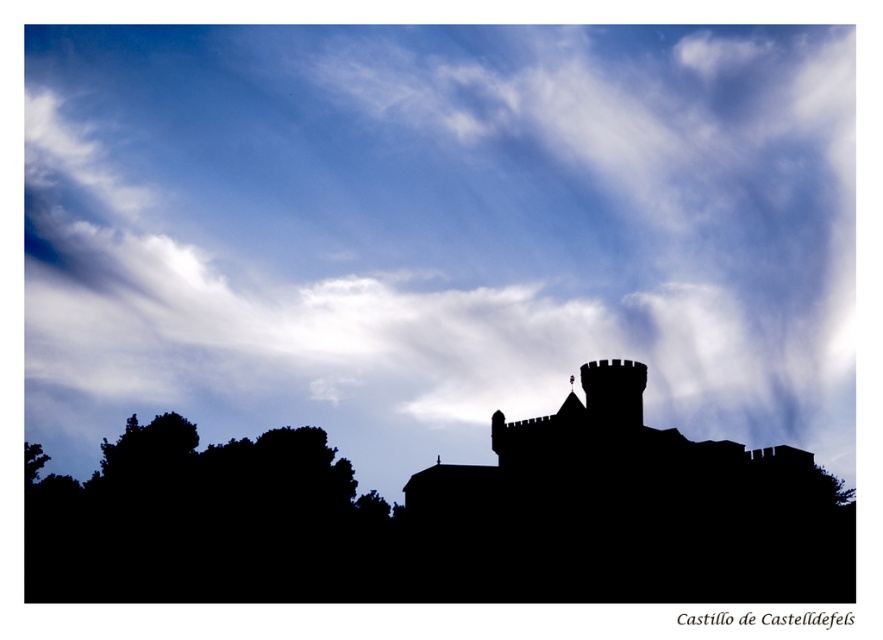
Between white fluffy cloud at upper center and silhouette stone castle at center, which one is positioned higher?

white fluffy cloud at upper center is higher up.

Who is positioned more to the left, white fluffy cloud at upper center or silhouette stone castle at center?

white fluffy cloud at upper center

Does point (244, 268) come in front of point (737, 458)?

No, (244, 268) is further to viewer.

Identify the location of white fluffy cloud at upper center. (436, 230).

Is white fluffy cloud at upper center smaller than black leafy tree at lower left?

No.

Where is `white fluffy cloud at upper center`? white fluffy cloud at upper center is located at coordinates (436, 230).

Can you confirm if silhouette stone castle at center is positioned to the right of black leafy tree at lower left?

Indeed, silhouette stone castle at center is positioned on the right side of black leafy tree at lower left.

Is silhouette stone castle at center shorter than black leafy tree at lower left?

No, silhouette stone castle at center is not shorter than black leafy tree at lower left.

Which is in front, point (565, 481) or point (314, 532)?

Point (565, 481) is in front.

Identify the location of silhouette stone castle at center. (625, 513).